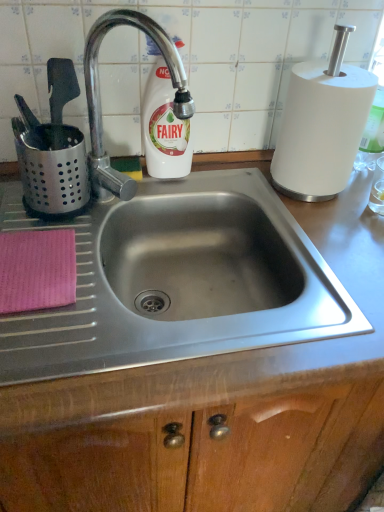
Question: Does polished metal faucet at upper left lie behind white glossy bottle at upper center?

Choices:
 (A) yes
 (B) no

Answer: (B)

Question: From the image's perspective, would you say polished metal faucet at upper left is shown under white glossy bottle at upper center?

Choices:
 (A) yes
 (B) no

Answer: (A)

Question: Can you confirm if polished metal faucet at upper left is taller than white glossy bottle at upper center?

Choices:
 (A) no
 (B) yes

Answer: (B)

Question: Does polished metal faucet at upper left have a lesser height compared to white glossy bottle at upper center?

Choices:
 (A) no
 (B) yes

Answer: (A)

Question: From the image's perspective, would you say polished metal faucet at upper left is positioned over white glossy bottle at upper center?

Choices:
 (A) no
 (B) yes

Answer: (A)

Question: Can you confirm if polished metal faucet at upper left is thinner than white glossy bottle at upper center?

Choices:
 (A) yes
 (B) no

Answer: (B)

Question: Can you confirm if white glossy bottle at upper center is taller than polished metal faucet at upper left?

Choices:
 (A) no
 (B) yes

Answer: (A)

Question: Considering the relative sizes of white glossy bottle at upper center and polished metal faucet at upper left in the image provided, is white glossy bottle at upper center wider than polished metal faucet at upper left?

Choices:
 (A) yes
 (B) no

Answer: (B)

Question: Is white glossy bottle at upper center in front of polished metal faucet at upper left?

Choices:
 (A) no
 (B) yes

Answer: (A)

Question: Is white glossy bottle at upper center to the left of polished metal faucet at upper left from the viewer's perspective?

Choices:
 (A) yes
 (B) no

Answer: (B)

Question: Is white glossy bottle at upper center further to camera compared to polished metal faucet at upper left?

Choices:
 (A) yes
 (B) no

Answer: (A)

Question: From the image's perspective, would you say white glossy bottle at upper center is shown under polished metal faucet at upper left?

Choices:
 (A) yes
 (B) no

Answer: (B)

Question: Does metallic stainless steel sink at center come behind white matte paper towel at upper right?

Choices:
 (A) yes
 (B) no

Answer: (B)